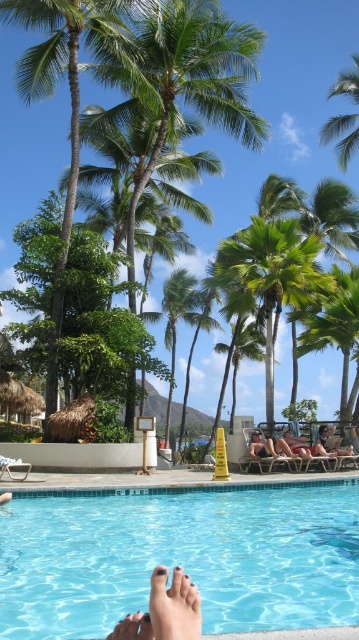
Question: Does green leafy palm tree at left come behind green leafy palm tree at center?

Choices:
 (A) no
 (B) yes

Answer: (A)

Question: Based on their relative distances, which object is nearer to the tan leather chair at center?

Choices:
 (A) tan leather chair at lower center
 (B) green leafy palm tree at left
 (C) green leafy palm tree at center

Answer: (A)

Question: Can you confirm if green leafy palm tree at center is positioned above tan leather chair at center?

Choices:
 (A) yes
 (B) no

Answer: (A)

Question: Where is tan leather chair at center located in relation to tan leather chair at lower center in the image?

Choices:
 (A) above
 (B) below

Answer: (A)

Question: Estimate the real-world distances between objects in this image. Which object is closer to the green leafy palm tree at left?

Choices:
 (A) blue glossy water at lower center
 (B) green leafy palm tree at upper center
 (C) tan leather chair at lower center
 (D) tan leather chair at center

Answer: (B)

Question: Among these points, which one is farthest from the camera?

Choices:
 (A) (48, 387)
 (B) (141, 58)
 (C) (286, 452)

Answer: (B)